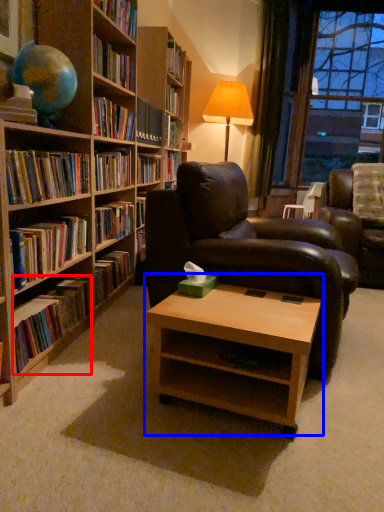
Question: Which object is further to the camera taking this photo, book (highlighted by a red box) or coffee table (highlighted by a blue box)?

Choices:
 (A) book
 (B) coffee table

Answer: (A)